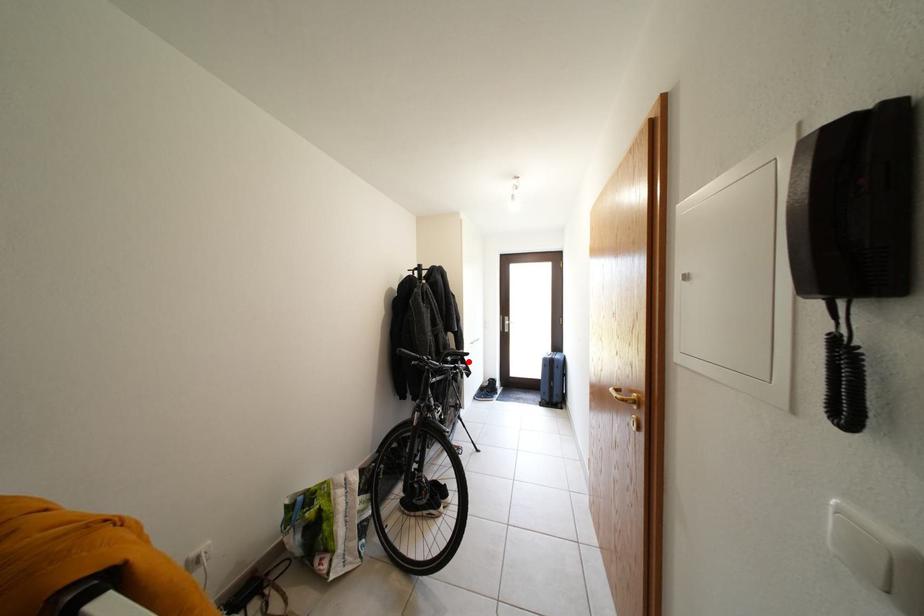
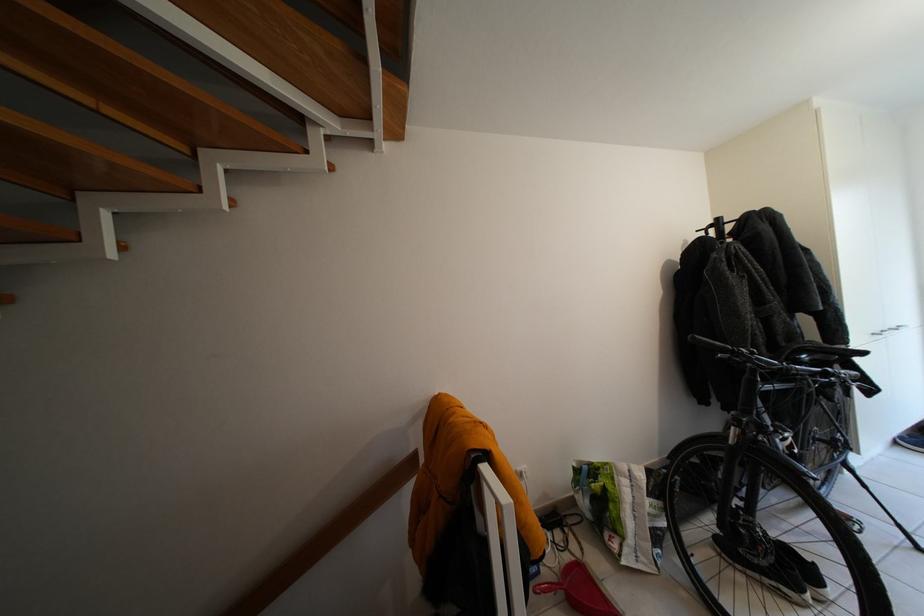
Locate, in the second image, the point that corresponds to the highlighted location in the first image.

(846, 361)